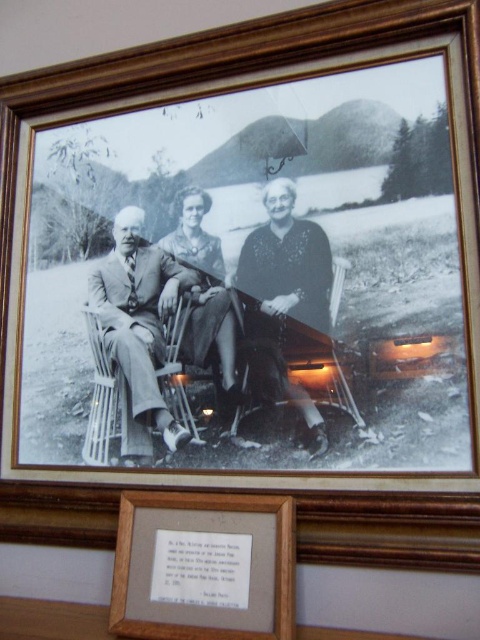
In the photograph, there are two suits depicted. The smooth fabric suit at center and the matte suit at left. Which suit is placed in front of the other?

The smooth fabric suit at center is positioned over matte suit at left, so it is placed in front of the matte suit at left.